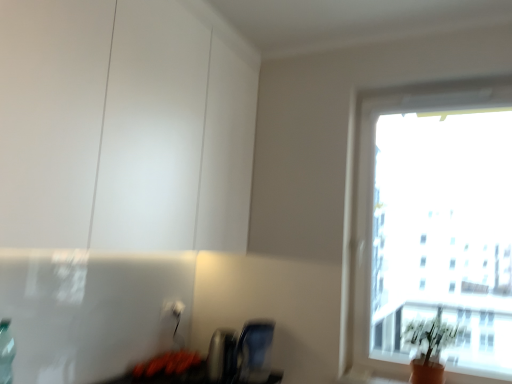
Question: From the image's perspective, does white plastic electric outlet at lower center, the second electric outlet in the left-to-right sequence, appear higher than matte white cabinet at upper left?

Choices:
 (A) no
 (B) yes

Answer: (A)

Question: Is white plastic electric outlet at lower center, the second electric outlet in the left-to-right sequence, surrounding matte white cabinet at upper left?

Choices:
 (A) no
 (B) yes

Answer: (A)

Question: From a real-world perspective, is white plastic electric outlet at lower center, the second electric outlet in the left-to-right sequence, physically above matte white cabinet at upper left?

Choices:
 (A) yes
 (B) no

Answer: (B)

Question: Can you confirm if white plastic electric outlet at lower center, the second electric outlet in the left-to-right sequence, is thinner than matte white cabinet at upper left?

Choices:
 (A) no
 (B) yes

Answer: (B)

Question: Is white plastic electric outlet at lower center, the second electric outlet in the left-to-right sequence, oriented towards matte white cabinet at upper left?

Choices:
 (A) yes
 (B) no

Answer: (B)

Question: From the image's perspective, is matte blue swivel chair at lower center located above or below white plastic electric outlet at lower center, the second electric outlet in the left-to-right sequence?

Choices:
 (A) below
 (B) above

Answer: (A)

Question: In terms of width, does matte blue swivel chair at lower center look wider or thinner when compared to white plastic electric outlet at lower center, the 1th electric outlet in the right-to-left sequence?

Choices:
 (A) wide
 (B) thin

Answer: (A)

Question: Which is correct: matte blue swivel chair at lower center is inside white plastic electric outlet at lower center, the 1th electric outlet in the right-to-left sequence, or outside of it?

Choices:
 (A) outside
 (B) inside

Answer: (A)

Question: In terms of size, does matte blue swivel chair at lower center appear bigger or smaller than white plastic electric outlet at lower center, the second electric outlet in the left-to-right sequence?

Choices:
 (A) small
 (B) big

Answer: (B)

Question: Does point (174, 307) appear closer or farther from the camera than point (250, 344)?

Choices:
 (A) closer
 (B) farther

Answer: (B)

Question: Is white plastic electric outlet at lower center, acting as the second electric outlet starting from the right, inside the boundaries of matte blue swivel chair at lower center, or outside?

Choices:
 (A) inside
 (B) outside

Answer: (B)

Question: Considering the relative positions of white plastic electric outlet at lower center, which is the first electric outlet in left-to-right order, and matte blue swivel chair at lower center in the image provided, is white plastic electric outlet at lower center, which is the first electric outlet in left-to-right order, to the left or to the right of matte blue swivel chair at lower center?

Choices:
 (A) right
 (B) left

Answer: (B)

Question: Considering the positions of white plastic electric outlet at lower center, which is the first electric outlet in left-to-right order, and matte blue swivel chair at lower center in the image, is white plastic electric outlet at lower center, which is the first electric outlet in left-to-right order, wider or thinner than matte blue swivel chair at lower center?

Choices:
 (A) thin
 (B) wide

Answer: (A)

Question: In terms of width, does matte blue swivel chair at lower center look wider or thinner when compared to transparent glass window at upper right?

Choices:
 (A) thin
 (B) wide

Answer: (B)

Question: From their relative heights in the image, would you say matte blue swivel chair at lower center is taller or shorter than transparent glass window at upper right?

Choices:
 (A) short
 (B) tall

Answer: (A)